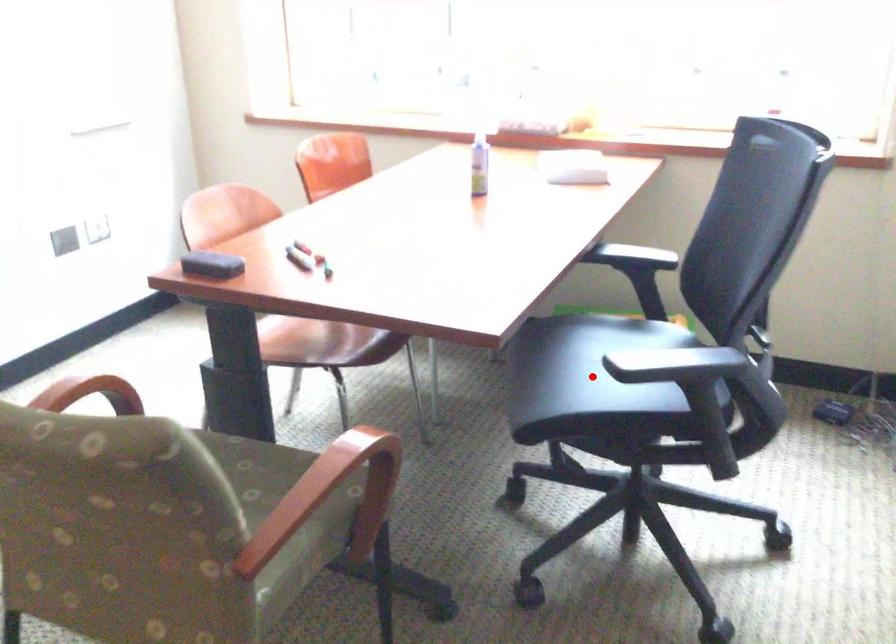
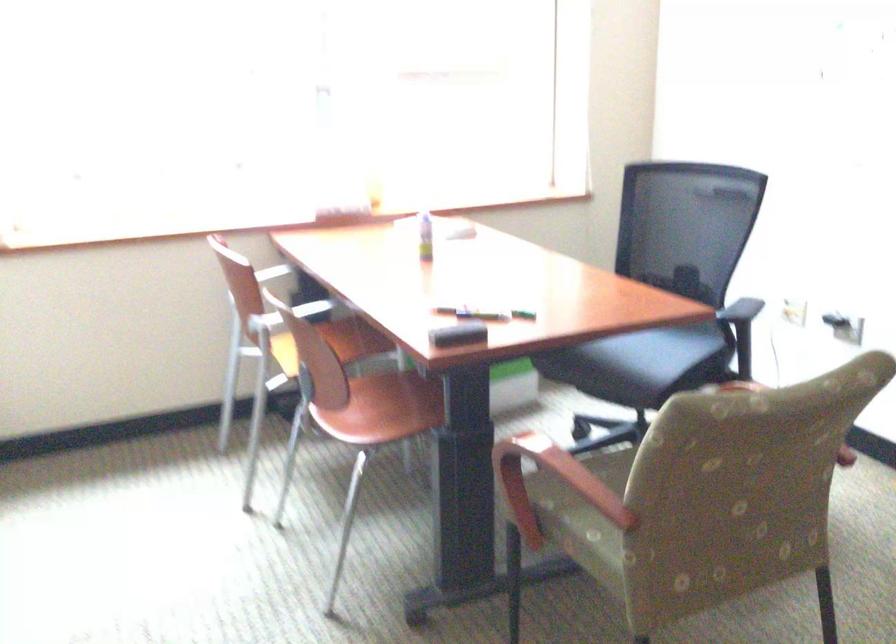
Question: A red point is marked in image1. In image2, is the corresponding 3D point closer to the camera or farther? Reply with the corresponding letter.

Choices:
 (A) The corresponding 3D point is closer.
 (B) The corresponding 3D point is farther.

Answer: (B)